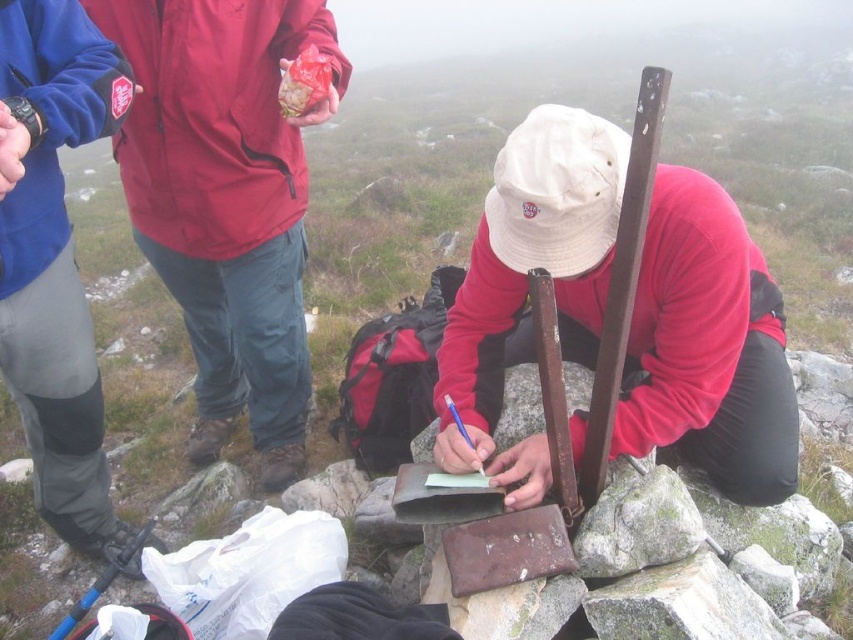
Question: Does matte red jacket at left appear on the right side of shiny plastic bag at upper center?

Choices:
 (A) no
 (B) yes

Answer: (A)

Question: Which object is positioned closest to the shiny plastic bag at upper center?

Choices:
 (A) matte red shirt at center
 (B) matte red jacket at left
 (C) brushed metal jacket at upper left

Answer: (B)

Question: Is matte red shirt at center to the right of matte red jacket at left from the viewer's perspective?

Choices:
 (A) yes
 (B) no

Answer: (A)

Question: Considering the real-world distances, which object is closest to the brushed metal jacket at upper left?

Choices:
 (A) shiny plastic bag at upper center
 (B) matte red shirt at center
 (C) matte red jacket at left

Answer: (C)

Question: Does matte red jacket at left appear over shiny plastic bag at upper center?

Choices:
 (A) yes
 (B) no

Answer: (B)

Question: Which of the following is the farthest from the observer?

Choices:
 (A) matte red shirt at center
 (B) shiny plastic bag at upper center

Answer: (B)